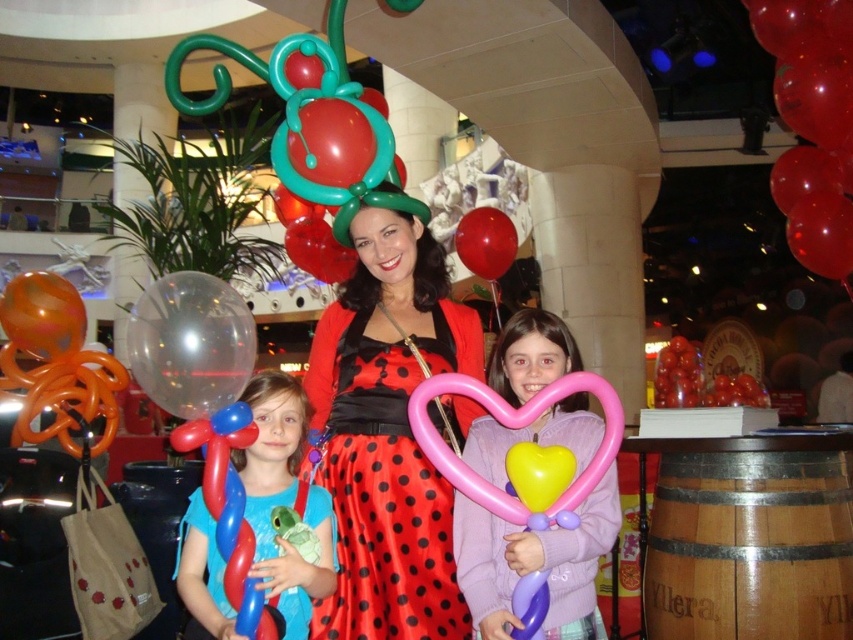
You are standing at the origin point in the image. There are two points marked in the scene. Which of the two points, point (846, 104) or point (509, 451), is farther away from you?

Point (846, 104) is farther away from you because it is behind point (509, 451).

Consider the image. You are standing in the middle of the venue and want to move towards the two points marked in the image. Which point, point (177,412) or point (492,252), is closer to you?

Point (177,412) is closer to the viewer than point (492,252).